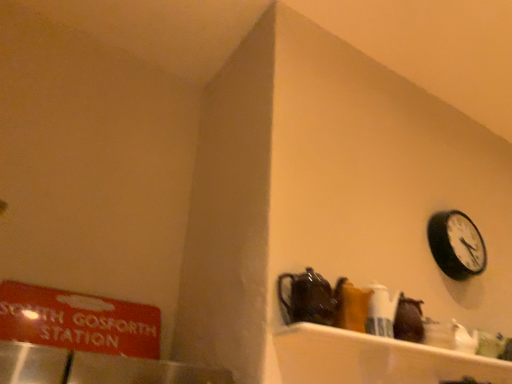
At what (x,y) coordinates should I click in order to perform the action: click on black matte wall clock at upper right. Please return your answer as a coordinate pair (x, y). Image resolution: width=512 pixels, height=384 pixels. Looking at the image, I should click on [456, 245].

The height and width of the screenshot is (384, 512). Identify the location of wall clock on the right of shiny dark brown teapot at center. (456, 245).

How distant is black matte wall clock at upper right from shiny dark brown teapot at center?

black matte wall clock at upper right is 38.16 inches from shiny dark brown teapot at center.

Are black matte wall clock at upper right and shiny dark brown teapot at center located far from each other?

They are positioned close to each other.

Is black matte wall clock at upper right completely or partially outside of shiny dark brown teapot at center?

black matte wall clock at upper right lies outside shiny dark brown teapot at center's area.

What's the angular difference between red matte sign at left and black matte wall clock at upper right's facing directions?

red matte sign at left and black matte wall clock at upper right are facing 0.705 degrees away from each other.

Which of these two, red matte sign at left or black matte wall clock at upper right, stands shorter?

red matte sign at left is shorter.

Choose the correct answer: Is red matte sign at left inside black matte wall clock at upper right or outside it?

red matte sign at left exists outside the volume of black matte wall clock at upper right.

From the image's perspective, relative to black matte wall clock at upper right, is red matte sign at left above or below?

Clearly, from the image's perspective, red matte sign at left is below black matte wall clock at upper right.

Which of these two, shiny dark brown teapot at center or red matte sign at left, stands shorter?

Standing shorter between the two is shiny dark brown teapot at center.

From a real-world perspective, which is physically above, shiny dark brown teapot at center or red matte sign at left?

shiny dark brown teapot at center, from a real-world perspective.

Does shiny dark brown teapot at center have a greater width compared to red matte sign at left?

Correct, the width of shiny dark brown teapot at center exceeds that of red matte sign at left.

Locate an element on the screen. This screenshot has width=512, height=384. tea pot in front of the red matte sign at left is located at coordinates (x=311, y=297).

Who is bigger, red matte sign at left or shiny dark brown teapot at center?

red matte sign at left.

From the image's perspective, would you say red matte sign at left is shown under shiny dark brown teapot at center?

Yes, from the image's perspective, red matte sign at left is below shiny dark brown teapot at center.

How different are the orientations of red matte sign at left and shiny dark brown teapot at center in degrees?

They differ by 0.193 degrees in their facing directions.

Which is in front, red matte sign at left or shiny dark brown teapot at center?

Positioned in front is shiny dark brown teapot at center.

Is black matte wall clock at upper right oriented towards red matte sign at left?

No, black matte wall clock at upper right is not facing towards red matte sign at left.

Is black matte wall clock at upper right at the left side of red matte sign at left?

Incorrect, black matte wall clock at upper right is not on the left side of red matte sign at left.

Is red matte sign at left located within black matte wall clock at upper right?

No, red matte sign at left is not surrounded by black matte wall clock at upper right.

Is shiny dark brown teapot at center far from black matte wall clock at upper right?

shiny dark brown teapot at center is actually quite close to black matte wall clock at upper right.

The image size is (512, 384). I want to click on tea pot below the black matte wall clock at upper right (from the image's perspective), so click(x=311, y=297).

Consider the image. Is shiny dark brown teapot at center closer to the viewer compared to black matte wall clock at upper right?

That is True.

How many degrees apart are the facing directions of shiny dark brown teapot at center and black matte wall clock at upper right?

They differ by 0.898 degrees in their facing directions.

Where is `tea pot in front of the black matte wall clock at upper right`? tea pot in front of the black matte wall clock at upper right is located at coordinates (311, 297).

The image size is (512, 384). In order to click on sign lying below the black matte wall clock at upper right (from the image's perspective) in this screenshot , I will do `click(78, 321)`.

Estimate the real-world distances between objects in this image. Which object is further from shiny dark brown teapot at center, black matte wall clock at upper right or red matte sign at left?

The object further to shiny dark brown teapot at center is black matte wall clock at upper right.

From the image, which object appears to be nearer to red matte sign at left, black matte wall clock at upper right or shiny dark brown teapot at center?

shiny dark brown teapot at center is closer to red matte sign at left.

From the image, which object appears to be farther from black matte wall clock at upper right, shiny dark brown teapot at center or red matte sign at left?

red matte sign at left is positioned further to the anchor black matte wall clock at upper right.

From the image, which object appears to be nearer to shiny dark brown teapot at center, red matte sign at left or black matte wall clock at upper right?

Based on the image, red matte sign at left appears to be nearer to shiny dark brown teapot at center.

Based on the photo, from the image, which object appears to be nearer to black matte wall clock at upper right, red matte sign at left or shiny dark brown teapot at center?

Based on the image, shiny dark brown teapot at center appears to be nearer to black matte wall clock at upper right.

Estimate the real-world distances between objects in this image. Which object is further from red matte sign at left, shiny dark brown teapot at center or black matte wall clock at upper right?

Among the two, black matte wall clock at upper right is located further to red matte sign at left.

Find the location of a particular element. The image size is (512, 384). tea pot situated between red matte sign at left and black matte wall clock at upper right from left to right is located at coordinates (311, 297).